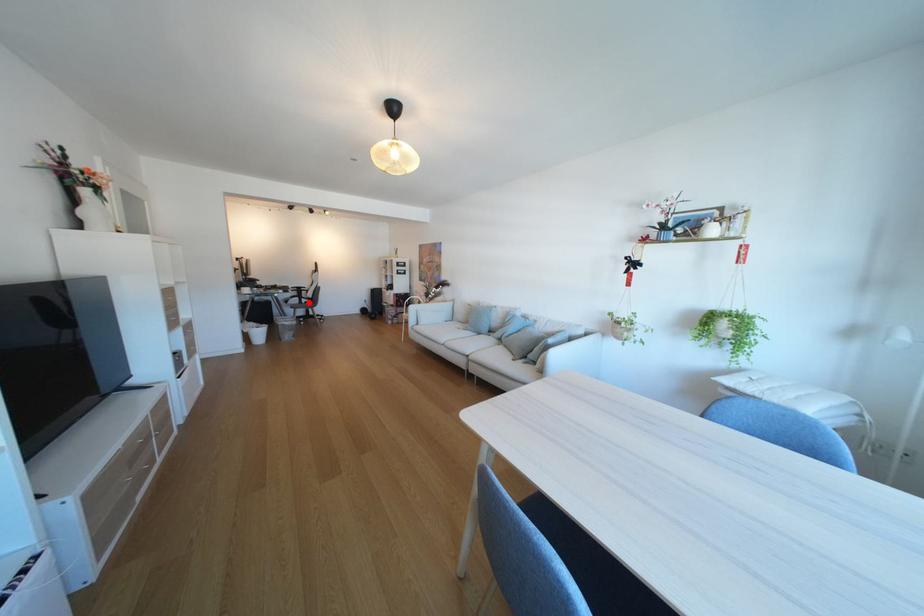
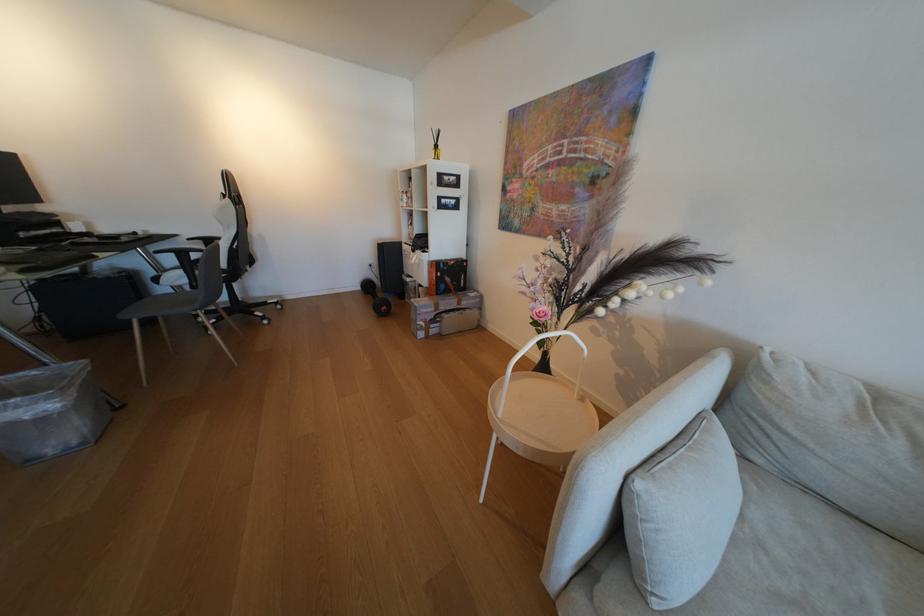
Question: I am providing you with two images of the same scene from different viewpoints. Given a red point in image1, look at the same physical point in image2. Is it:

Choices:
 (A) Closer to the viewpoint
 (B) Farther from the viewpoint

Answer: (B)